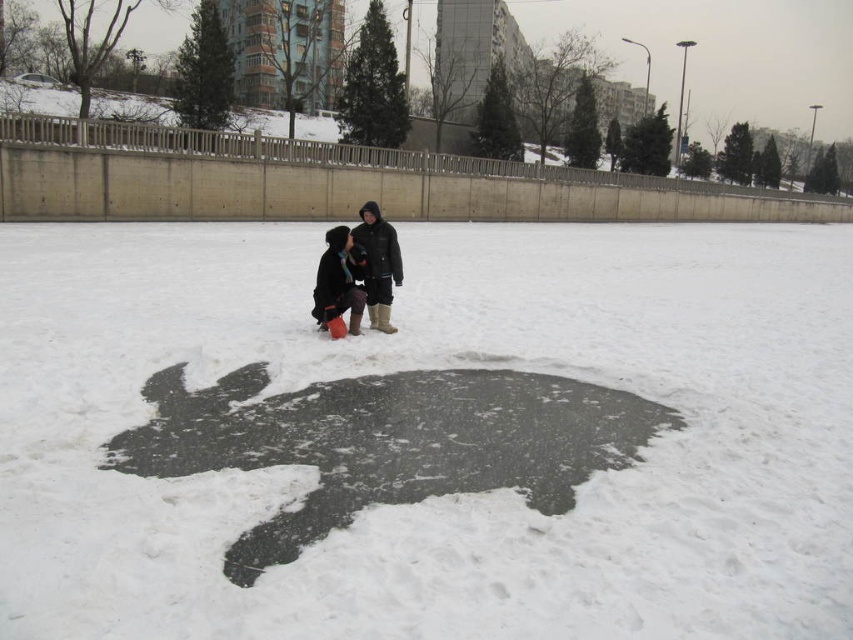
You are a drone operator who needs to hover your drone above the black matte snow at center. What are the coordinates to input into the drone for its location?

The coordinates for the black matte snow at center are at point (444,497).

You are a delivery robot with a 30 feet maximum delivery range. You need to deliver a package from the black matte snow at center to the dark brown fur coat at center. Can you complete the delivery?

The distance between the black matte snow at center and the dark brown fur coat at center is 30.05 feet, which exceeds the robot s 30 feet maximum delivery range. Therefore, the delivery cannot be completed.